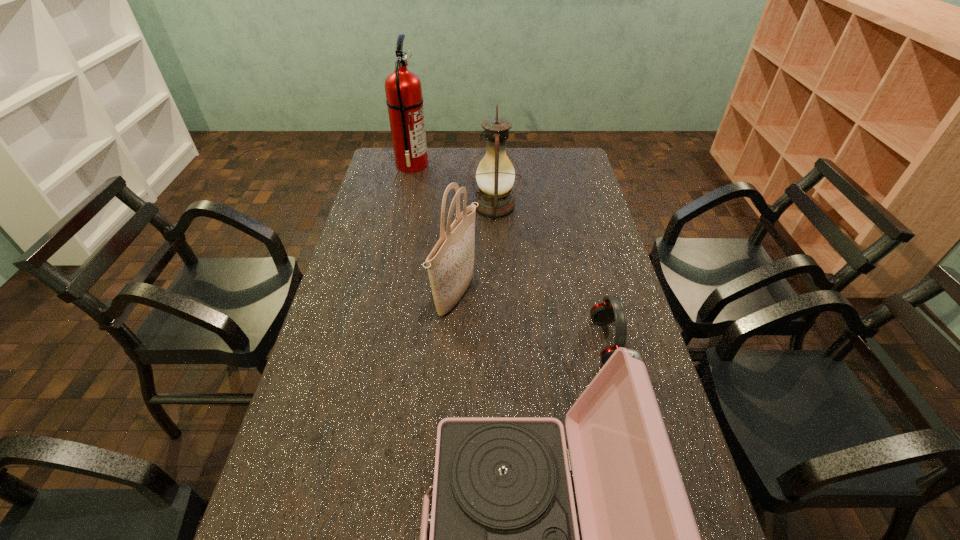
You are a GUI agent. You are given a task and a screenshot of the screen. Output one action in this format:
    pyautogui.click(x=<x>, y=<y>)
    Task: Click on the free space located 0.380m on the ear cups of the shortest object
    
    Given the screenshot: What is the action you would take?
    [459, 343]

Locate an element on the screen. Image resolution: width=960 pixels, height=540 pixels. free space located on the ear cups of the shortest object is located at coordinates (451, 343).

Where is `object situated at the far edge`? object situated at the far edge is located at coordinates (404, 100).

You are a GUI agent. You are given a task and a screenshot of the screen. Output one action in this format:
    pyautogui.click(x=<x>, y=<y>)
    Task: Click on the object positioned at the left edge
    This screenshot has height=540, width=960.
    Given the screenshot: What is the action you would take?
    pyautogui.click(x=404, y=100)

You are a GUI agent. You are given a task and a screenshot of the screen. Output one action in this format:
    pyautogui.click(x=<x>, y=<y>)
    Task: Click on the object that is at the right edge
    
    Given the screenshot: What is the action you would take?
    pyautogui.click(x=604, y=313)

This screenshot has height=540, width=960. In order to click on object at the far left corner in this screenshot , I will do `click(404, 100)`.

Identify the location of vacant space at the far edge of the desktop. The height and width of the screenshot is (540, 960). (543, 150).

Image resolution: width=960 pixels, height=540 pixels. In order to click on blank space at the left edge of the desktop in this screenshot , I will do `click(365, 267)`.

Identify the location of free space at the right edge of the desktop. (621, 291).

Identify the location of vacant point at the far left corner. (395, 173).